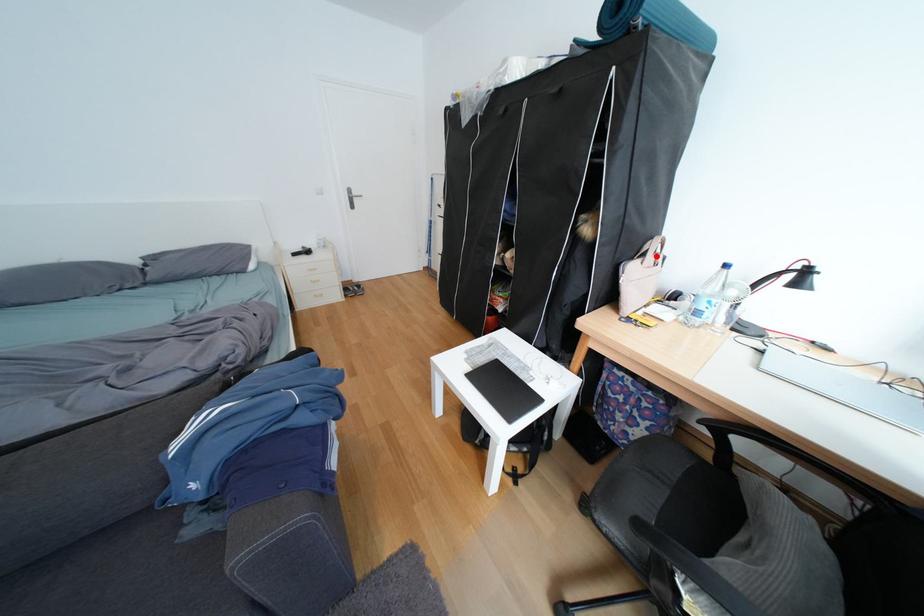
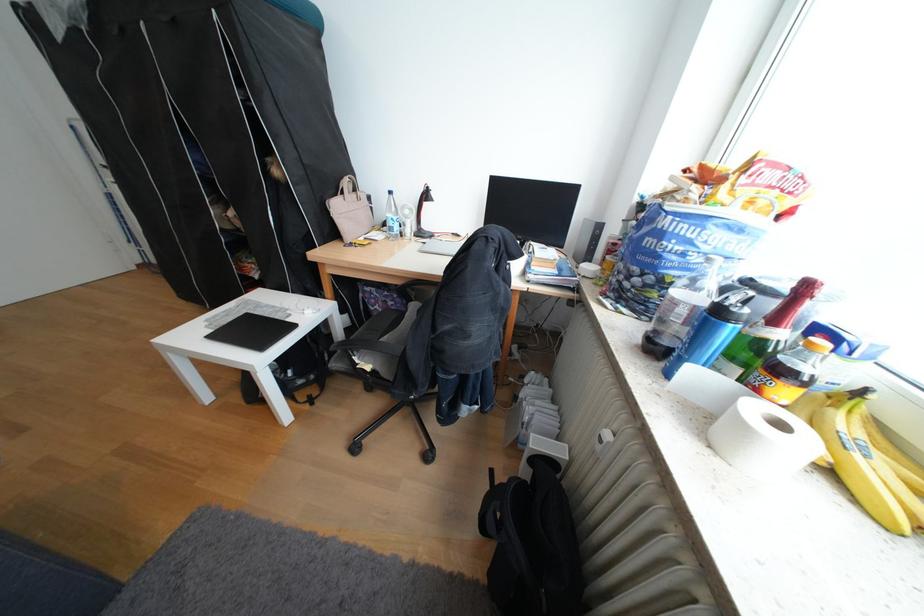
Locate, in the second image, the point that corresponds to the highlighted location in the first image.

(355, 193)